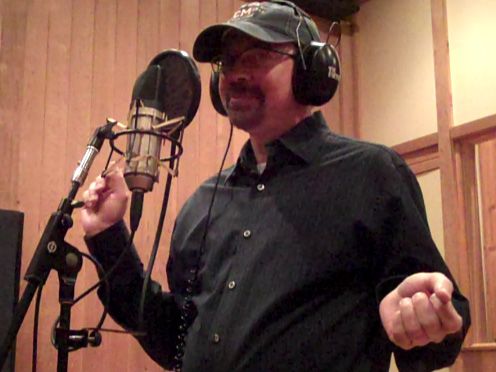
Find the location of a particular element. The image size is (496, 372). wood paneled wall is located at coordinates (85, 66).